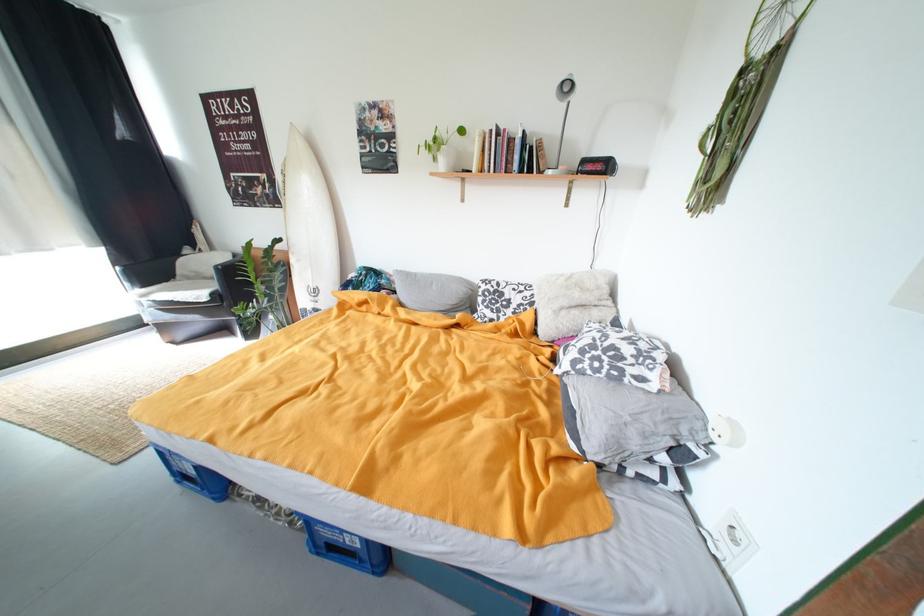
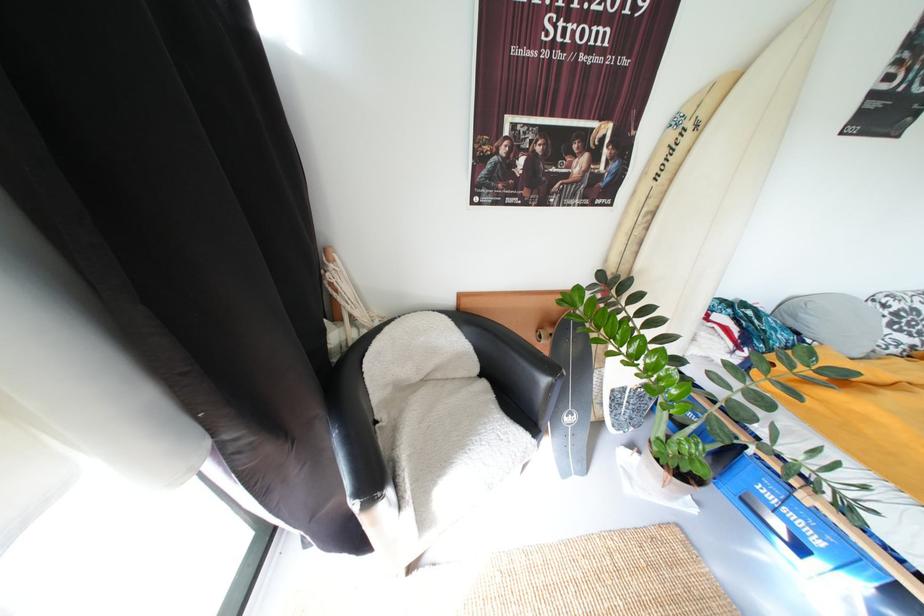
What movement of the cameraman would produce the second image?

The cameraman moved toward left, forward.